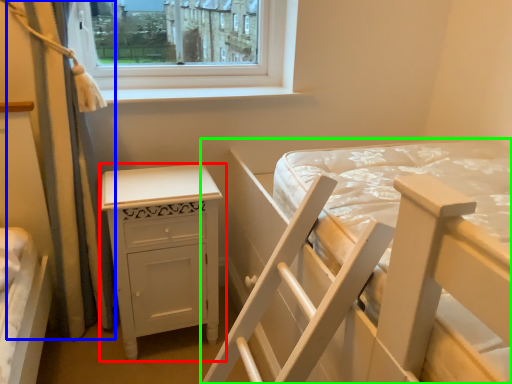
Question: Estimate the real-world distances between objects in this image. Which object is farther from nightstand (highlighted by a red box), curtain (highlighted by a blue box) or bed (highlighted by a green box)?

Choices:
 (A) curtain
 (B) bed

Answer: (B)